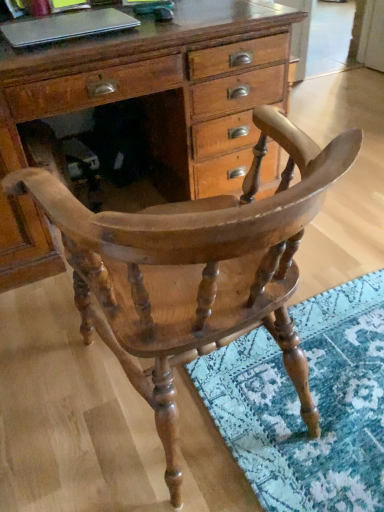
In order to click on vacant area on top of silver metallic laptop at upper left (from a real-world perspective) in this screenshot , I will do `click(78, 22)`.